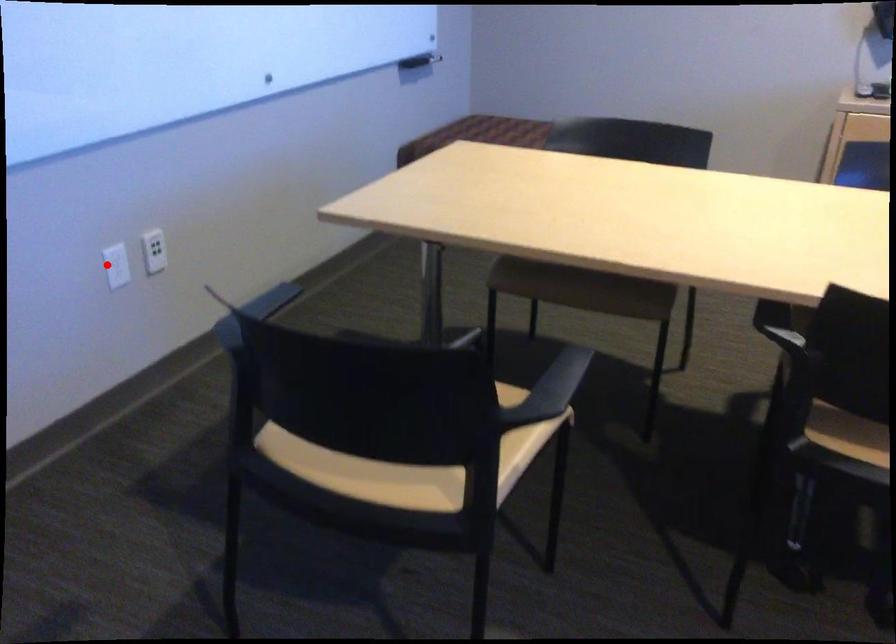
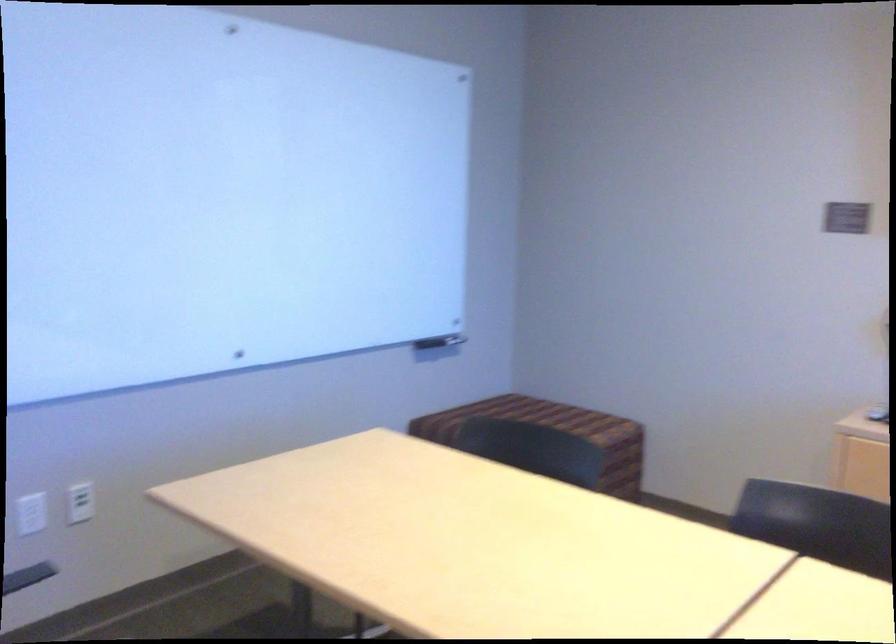
Question: I am providing you with two images of the same scene from different viewpoints. Image1 has a red point marked. In image2, the corresponding 3D location appears at what relative position? Reply with the corresponding letter.

Choices:
 (A) Closer
 (B) Farther

Answer: (B)